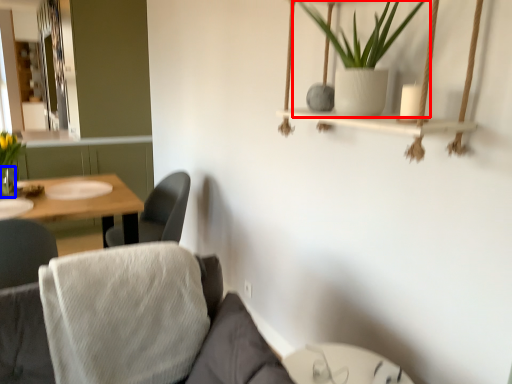
Question: Which object appears closest to the camera in this image, houseplant (highlighted by a red box) or glass vase (highlighted by a blue box)?

Choices:
 (A) houseplant
 (B) glass vase

Answer: (A)